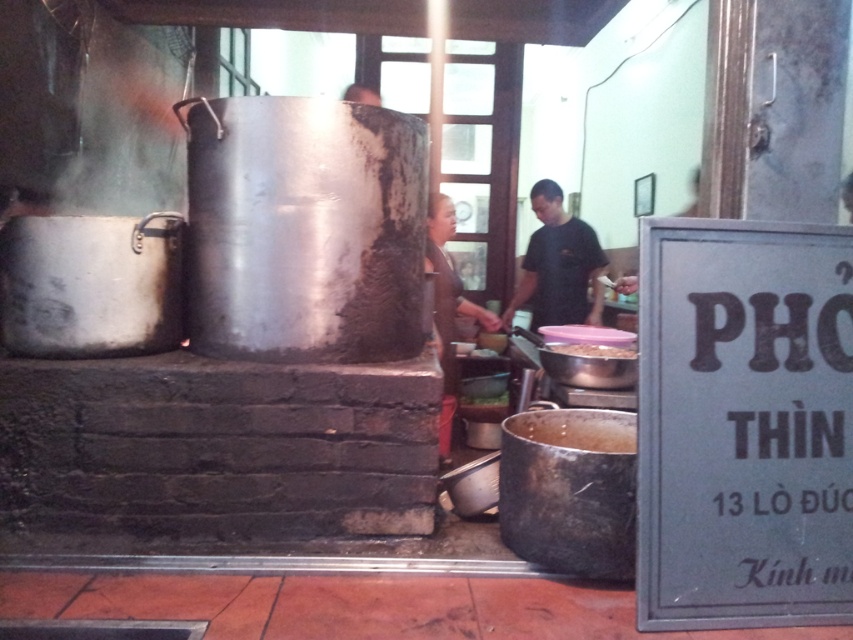
You are a chef in the kitchen and need to reach both the point at coordinates (543,221) and the point at coordinates (474,404). Which point will you reach first?

You will reach the point at coordinates (543,221) first because it is closer to you than the point at coordinates (474,404), which is further away.

You are a chef preparing to serve a bowl of pho. You have a white matte bowl at center and a matte silver pot at center in front of you. Which container should you use to serve the pho if you want to ensure it stays warm longer?

The matte silver pot at center retains heat better than the white matte bowl at center, so you should use the matte silver pot at center to keep the pho warm longer.

You are a chef in a busy kitchen and need to quickly grab a bowl to serve a customer. You see the white matte bowl at center and the matte silver pot at center. Which object should you reach for first?

The white matte bowl at center is closer to the viewer than the matte silver pot at center, so you should reach for the white matte bowl at center first.